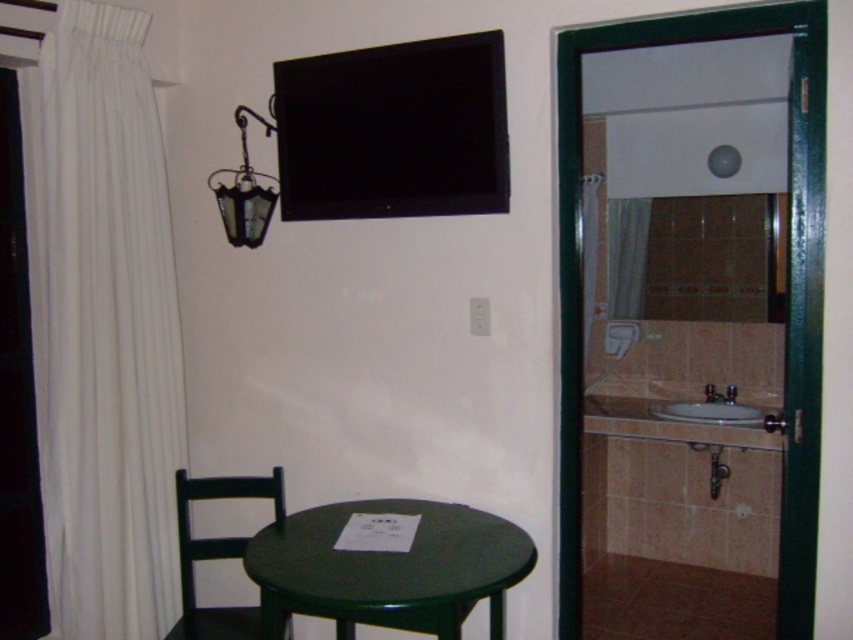
Question: Which object is farther from the camera taking this photo?

Choices:
 (A) black matte chair at lower left
 (B) black glossy flat at upper center

Answer: (B)

Question: Among these objects, which one is nearest to the camera?

Choices:
 (A) black matte chair at lower left
 (B) black glossy flat at upper center
 (C) green glossy table at lower center

Answer: (C)

Question: Is black glossy flat at upper center to the right of matte black lantern at upper left from the viewer's perspective?

Choices:
 (A) no
 (B) yes

Answer: (B)

Question: From the image, what is the correct spatial relationship of white fabric curtain at left in relation to white ceramic sink at right?

Choices:
 (A) below
 (B) above

Answer: (B)

Question: Which point is closer to the camera?

Choices:
 (A) (195, 628)
 (B) (409, 115)
 (C) (242, 220)

Answer: (A)

Question: Considering the relative positions of green glossy table at lower center and matte black lantern at upper left in the image provided, where is green glossy table at lower center located with respect to matte black lantern at upper left?

Choices:
 (A) above
 (B) below

Answer: (B)